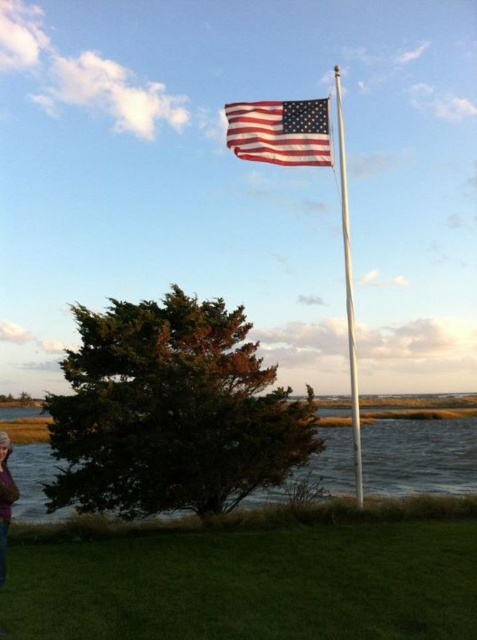
Question: Does green grass at lower center have a smaller size compared to silver metallic flag pole at upper center?

Choices:
 (A) yes
 (B) no

Answer: (A)

Question: Can you confirm if green grass at lower center is positioned to the left of silver metallic flag pole at upper center?

Choices:
 (A) yes
 (B) no

Answer: (A)

Question: Considering the real-world distances, which object is closest to the silver metallic flag pole at upper center?

Choices:
 (A) purple sweater at lower left
 (B) green grass at lower center
 (C) american flag at upper center

Answer: (B)

Question: Is american flag at upper center positioned at the back of purple sweater at lower left?

Choices:
 (A) yes
 (B) no

Answer: (A)

Question: Considering the real-world distances, which object is farthest from the purple sweater at lower left?

Choices:
 (A) american flag at upper center
 (B) silver metallic flag pole at upper center
 (C) green grass at lower center

Answer: (B)

Question: Which object appears farthest from the camera in this image?

Choices:
 (A) purple sweater at lower left
 (B) american flag at upper center

Answer: (B)